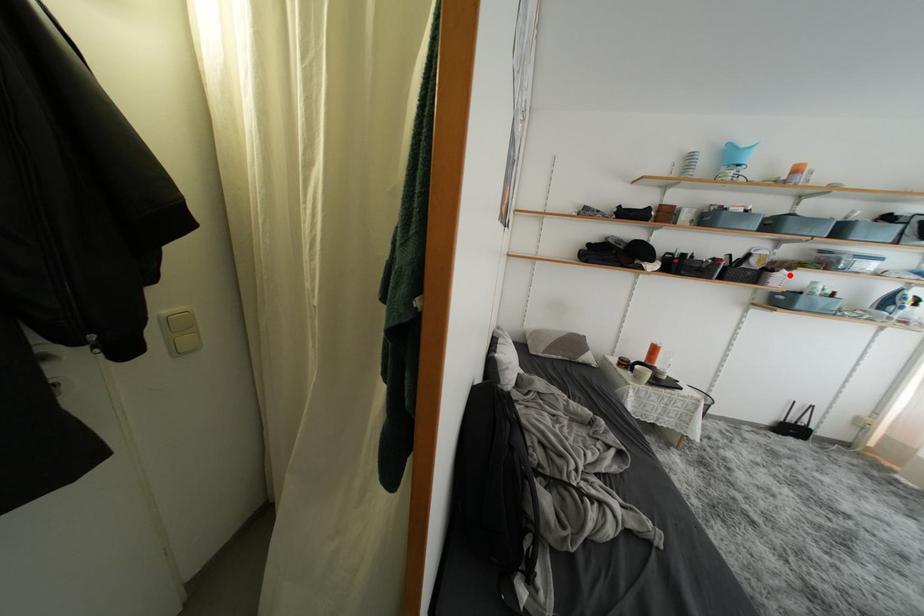
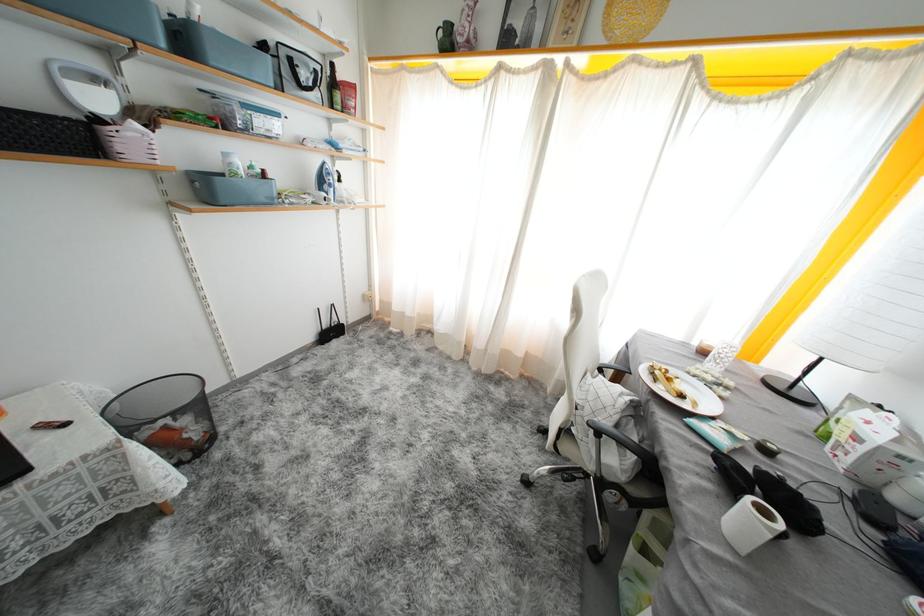
Question: I am providing you with two images of the same scene from different viewpoints. A red point is marked on the first image. Can you still see the location of the red point in image 2?

Choices:
 (A) Yes
 (B) No

Answer: (A)